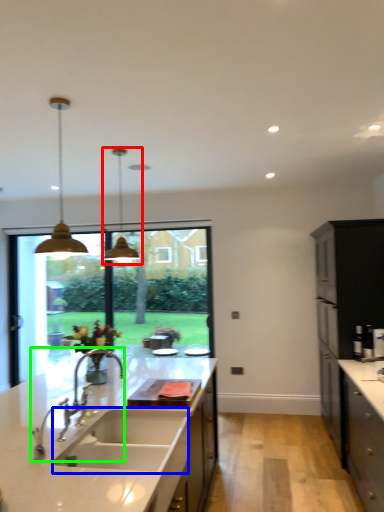
Question: Which object is positioned farthest from light fixture (highlighted by a red box)? Select from sink (highlighted by a blue box) and tap (highlighted by a green box).

Choices:
 (A) sink
 (B) tap

Answer: (A)